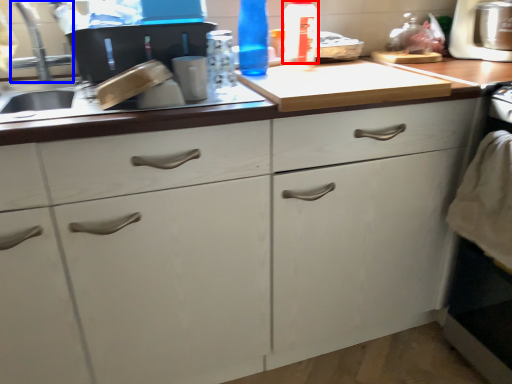
Question: Which of the following is the closest to the observer, bottle (highlighted by a red box) or faucet (highlighted by a blue box)?

Choices:
 (A) bottle
 (B) faucet

Answer: (B)